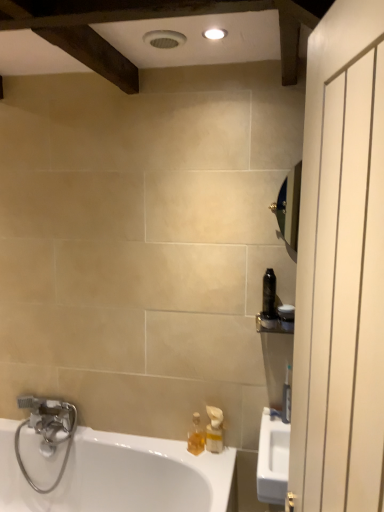
Where is `free location in front of translucent plastic soap dispenser at lower center, arranged as the first soap dispenser when viewed from the left`? free location in front of translucent plastic soap dispenser at lower center, arranged as the first soap dispenser when viewed from the left is located at coordinates (207, 467).